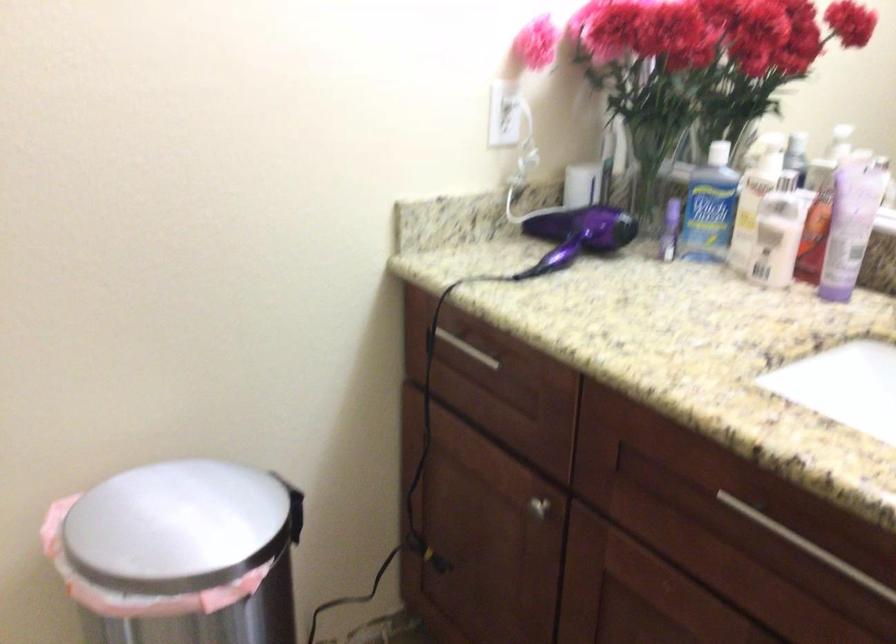
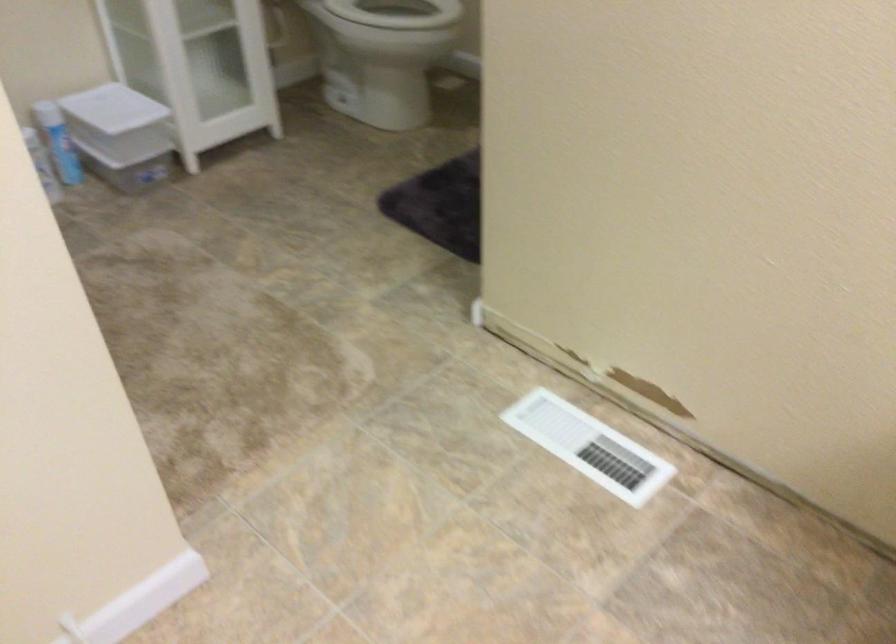
How did the camera likely rotate?

The rotation direction of the camera is left-down.